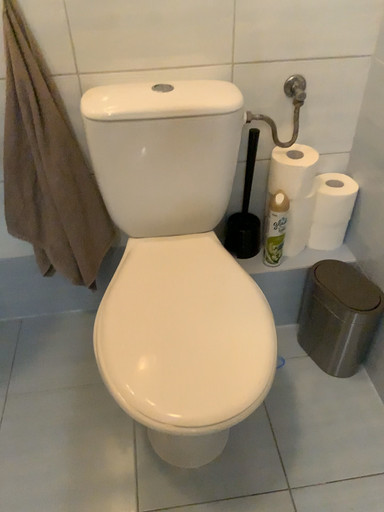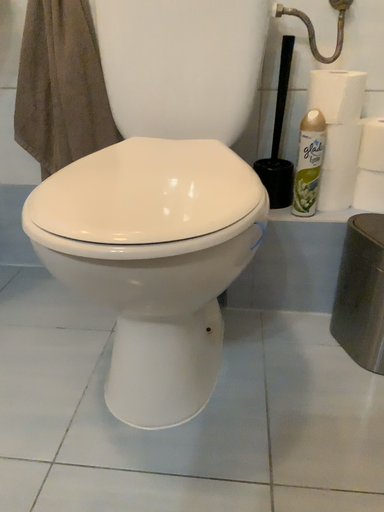
Question: Which way did the camera rotate in the video?

Choices:
 (A) rotated upward
 (B) rotated downward

Answer: (A)